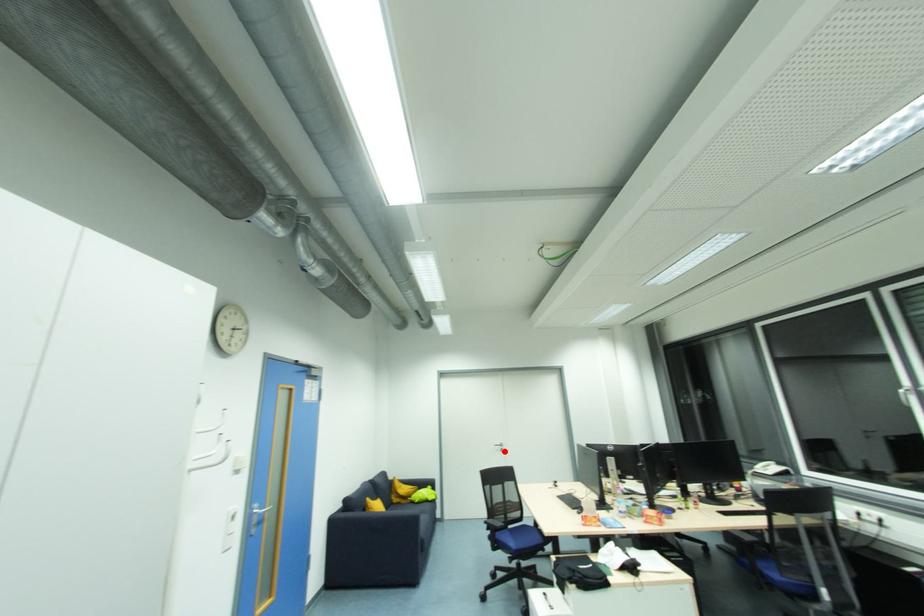
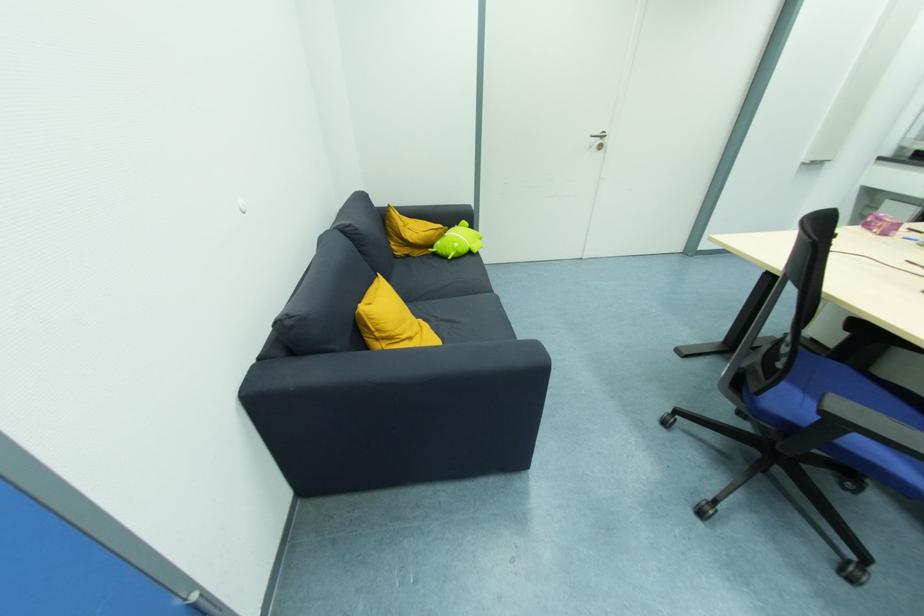
Find the pixel in the second image that matches the highlighted location in the first image.

(603, 148)